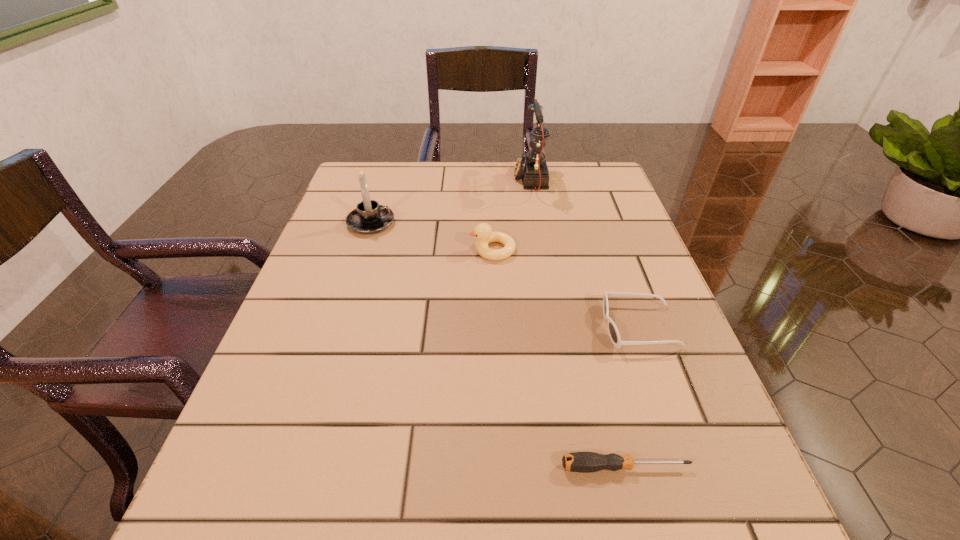
Identify the location of vacant area situated on the back of the screwdriver. The height and width of the screenshot is (540, 960). (612, 414).

At what (x,y) coordinates should I click in order to perform the action: click on object that is at the far edge. Please return your answer as a coordinate pair (x, y). The height and width of the screenshot is (540, 960). Looking at the image, I should click on (532, 166).

Identify the location of object present at the left edge. Image resolution: width=960 pixels, height=540 pixels. (369, 217).

The width and height of the screenshot is (960, 540). In order to click on sunglasses that is at the right edge in this screenshot , I will do `click(613, 332)`.

You are a GUI agent. You are given a task and a screenshot of the screen. Output one action in this format:
    pyautogui.click(x=<x>, y=<y>)
    Task: Click on the screwdriver positioned at the right edge
    
    Given the screenshot: What is the action you would take?
    pyautogui.click(x=583, y=462)

Find the location of a particular element. The width and height of the screenshot is (960, 540). vacant space at the far edge of the desktop is located at coordinates pos(415,161).

In order to click on vacant space at the near edge of the desktop in this screenshot , I will do `click(636, 514)`.

Find the location of a particular element. The image size is (960, 540). vacant space at the left edge of the desktop is located at coordinates (330, 356).

Where is `free space at the right edge`? free space at the right edge is located at coordinates (608, 270).

In the image, there is a desktop. Identify the location of vacant area at the far left corner. The width and height of the screenshot is (960, 540). pyautogui.click(x=345, y=204).